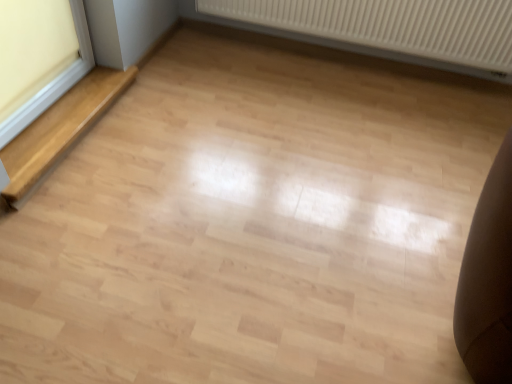
Question: Is point (74, 140) positioned closer to the camera than point (466, 66)?

Choices:
 (A) closer
 (B) farther

Answer: (A)

Question: From the image's perspective, relative to white ribbed radiator at upper center, is light wood stairwell at left above or below?

Choices:
 (A) below
 (B) above

Answer: (A)

Question: Based on their relative distances, which object is farther from the light wood stairwell at left?

Choices:
 (A) white ribbed radiator at upper center
 (B) white plastic window frame at left

Answer: (A)

Question: Based on their relative distances, which object is farther from the white plastic window frame at left?

Choices:
 (A) white ribbed radiator at upper center
 (B) light wood stairwell at left

Answer: (A)